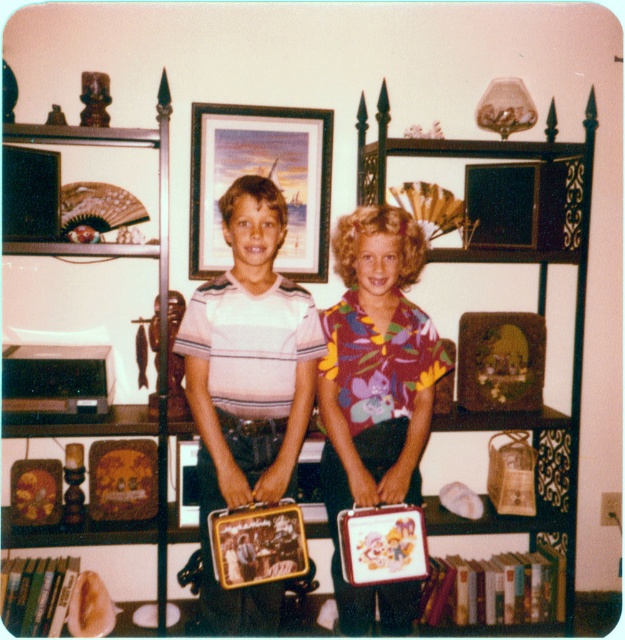
Question: Considering the relative positions of multicolored fabric shirt at center and wooden shelf at upper left in the image provided, where is multicolored fabric shirt at center located with respect to wooden shelf at upper left?

Choices:
 (A) left
 (B) right

Answer: (B)

Question: Which point is closer to the camera?

Choices:
 (A) (168, 205)
 (B) (566, 240)
 (C) (191, 260)
 (D) (378, 380)

Answer: (D)

Question: Can you confirm if wooden picture frame at center is thinner than wooden shelf at upper left?

Choices:
 (A) no
 (B) yes

Answer: (B)

Question: In this image, where is wooden picture frame at center located relative to wooden bookshelf at center?

Choices:
 (A) left
 (B) right

Answer: (A)

Question: Which is nearer to the wooden picture frame at center?

Choices:
 (A) metallic lunchbox at center
 (B) multicolored fabric shirt at center
 (C) wooden bookshelf at center

Answer: (C)

Question: Which point is closer to the camera taking this photo?

Choices:
 (A) (196, 253)
 (B) (381, 113)
 (C) (158, 243)
 (D) (320, 323)

Answer: (D)